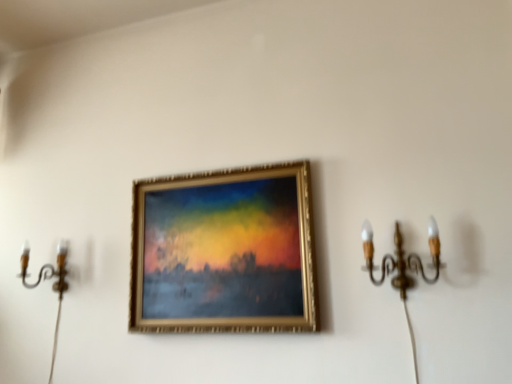
Question: Does gold metallic chandelier at right, which is the first candle holder from front to back, have a greater width compared to gold metallic picture frame at center?

Choices:
 (A) yes
 (B) no

Answer: (A)

Question: Is gold metallic chandelier at right, which is the second candle holder from left to right, beside gold metallic picture frame at center?

Choices:
 (A) no
 (B) yes

Answer: (A)

Question: Is gold metallic chandelier at right, which is the second candle holder from left to right, bigger than gold metallic picture frame at center?

Choices:
 (A) no
 (B) yes

Answer: (A)

Question: Can you confirm if gold metallic chandelier at right, which is the second candle holder from left to right, is shorter than gold metallic picture frame at center?

Choices:
 (A) no
 (B) yes

Answer: (B)

Question: From the image's perspective, is gold metallic chandelier at right, which appears as the 1th candle holder when viewed from the right, below gold metallic picture frame at center?

Choices:
 (A) yes
 (B) no

Answer: (B)

Question: Considering the positions of point (219, 301) and point (25, 268), is point (219, 301) closer or farther from the camera than point (25, 268)?

Choices:
 (A) farther
 (B) closer

Answer: (B)

Question: Looking at their shapes, would you say gold metallic picture frame at center is wider or thinner than gold metallic candle holder at left, placed as the 2th candle holder when sorted from right to left?

Choices:
 (A) wide
 (B) thin

Answer: (B)

Question: Is gold metallic picture frame at center in front of or behind gold metallic candle holder at left, acting as the first candle holder starting from the back, in the image?

Choices:
 (A) behind
 (B) front

Answer: (B)

Question: Do you think gold metallic picture frame at center is within gold metallic candle holder at left, acting as the first candle holder starting from the back, or outside of it?

Choices:
 (A) outside
 (B) inside

Answer: (A)

Question: From their relative heights in the image, would you say gold metallic candle holder at left, placed as the 2th candle holder when sorted from right to left, is taller or shorter than gold metallic picture frame at center?

Choices:
 (A) short
 (B) tall

Answer: (A)

Question: Is gold metallic candle holder at left, the 1th candle holder viewed from the left, in front of or behind gold metallic picture frame at center in the image?

Choices:
 (A) front
 (B) behind

Answer: (B)

Question: Is point (67, 251) closer or farther from the camera than point (270, 206)?

Choices:
 (A) closer
 (B) farther

Answer: (B)

Question: From the image's perspective, is gold metallic candle holder at left, acting as the first candle holder starting from the back, located above or below gold metallic picture frame at center?

Choices:
 (A) above
 (B) below

Answer: (B)

Question: Is gold metallic picture frame at center wider or thinner than gold metallic chandelier at right, which is the second candle holder from left to right?

Choices:
 (A) thin
 (B) wide

Answer: (A)

Question: From a real-world perspective, relative to gold metallic chandelier at right, the second candle holder positioned from the back, is gold metallic picture frame at center vertically above or below?

Choices:
 (A) below
 (B) above

Answer: (B)